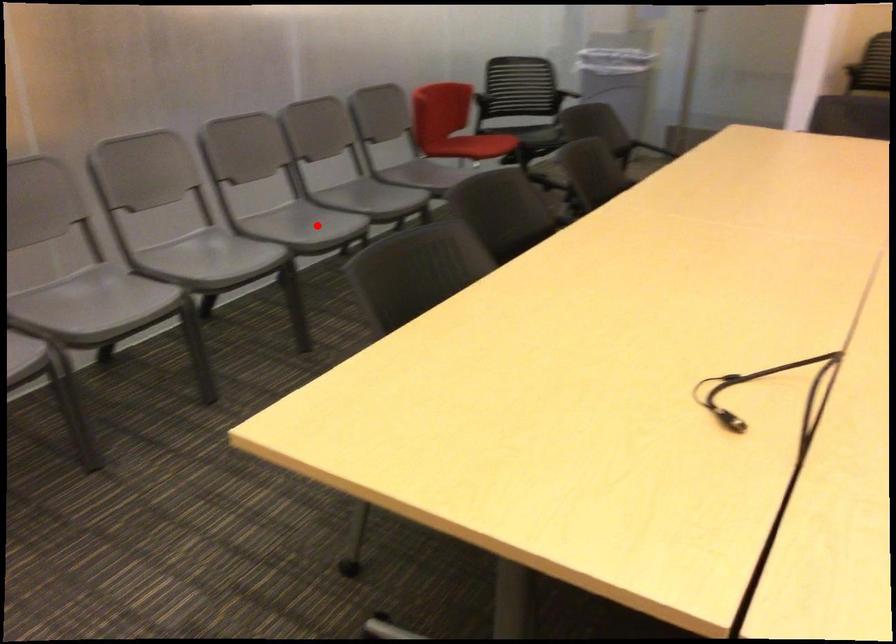
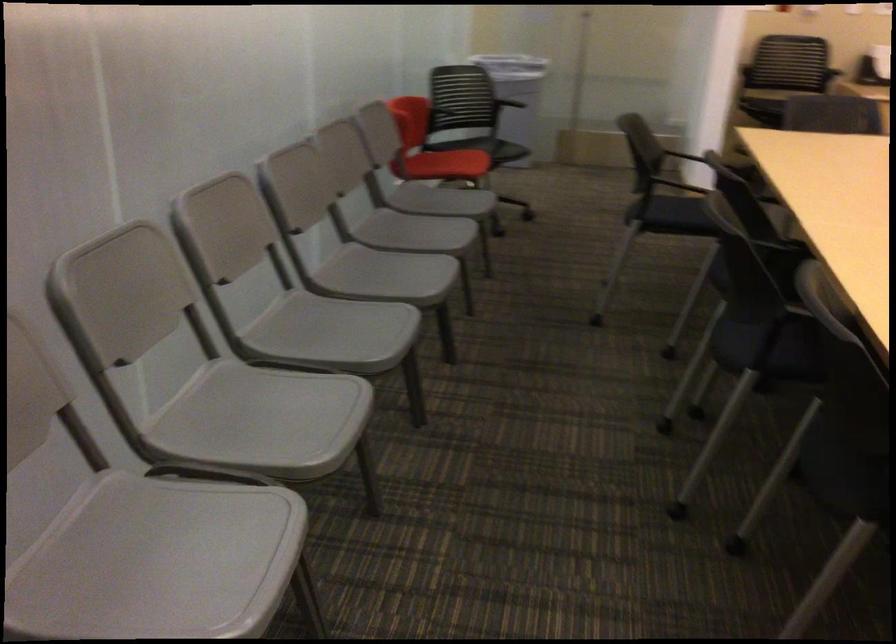
In the second image, find the point that corresponds to the highlighted location in the first image.

(385, 275)